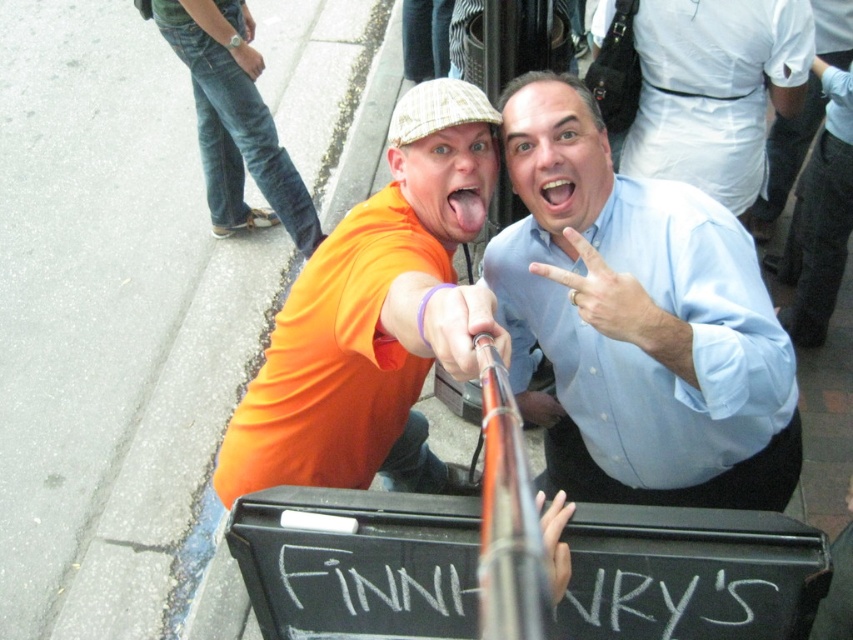
Who is more distant from viewer, (714, 326) or (552, 525)?

Positioned behind is point (714, 326).

Locate an element on the screen. This screenshot has width=853, height=640. light blue shirt at center is located at coordinates (639, 323).

Can you confirm if light blue shirt at center is shorter than white matte hand at center?

No, light blue shirt at center is not shorter than white matte hand at center.

At what (x,y) coordinates should I click in order to perform the action: click on light blue shirt at center. Please return your answer as a coordinate pair (x, y). Looking at the image, I should click on (639, 323).

Who is lower down, orange matte hand at center or smooth pink tongue at center?

orange matte hand at center is below.

Who is positioned more to the left, orange matte hand at center or smooth pink tongue at center?

orange matte hand at center is more to the left.

Describe the element at coordinates (461, 326) in the screenshot. I see `orange matte hand at center` at that location.

Identify the location of orange matte hand at center. (461, 326).